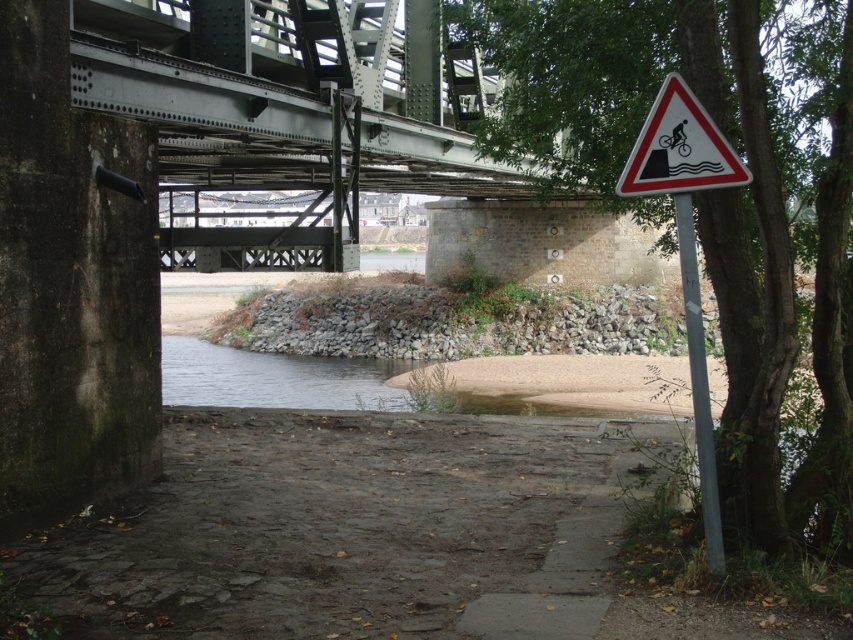
You are a cyclist approaching the bridge and notice the white plastic triangle at right and the white metallic pole at right. Which object is taller?

The white plastic triangle at right is taller than the white metallic pole at right.

You are a cyclist approaching the bridge and see the green leafy tree at right and the white metallic pole at right. Which object is closer to the ground?

The green leafy tree at right is located below the white metallic pole at right, so the green leafy tree at right is closer to the ground.

Consider the image. You are standing under the bridge and want to take a photo of the green leafy tree at right. If your camera can focus on objects up to 5 meters away, will it be able to capture the tree clearly?

→ The green leafy tree at right is 4.81 meters away from the camera, which is within the camera focus range of up to 5 meters. Therefore, the camera can capture the tree clearly.